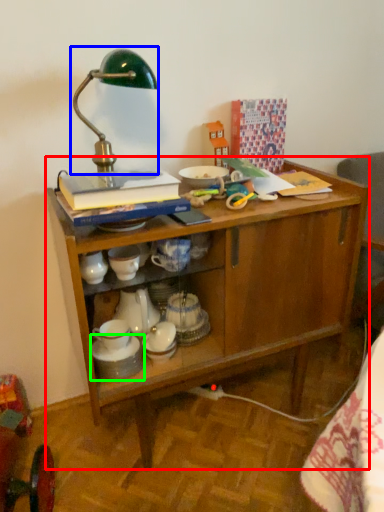
Question: Which object is the farthest from desk (highlighted by a red box)? Choose among these: table lamp (highlighted by a blue box) or tableware (highlighted by a green box).

Choices:
 (A) table lamp
 (B) tableware

Answer: (A)